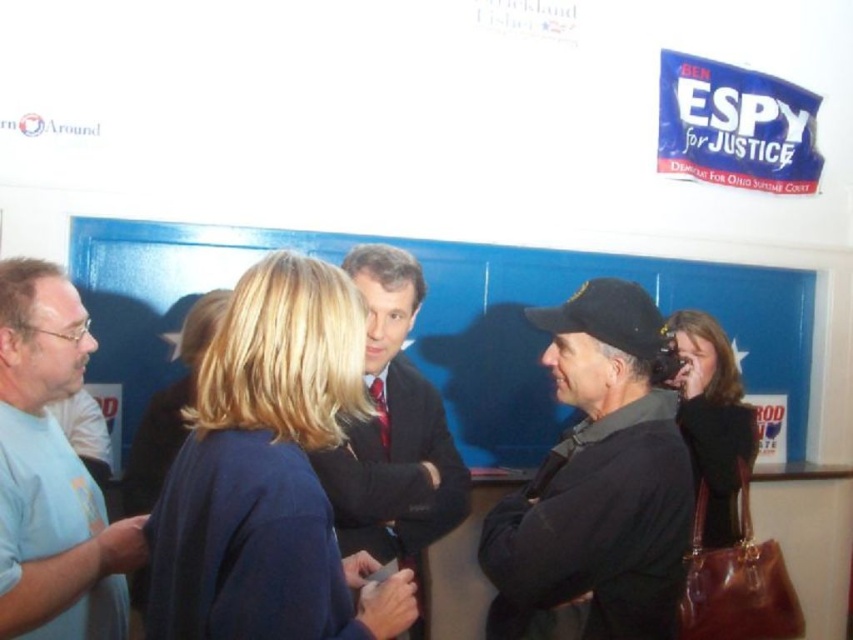
Who is positioned more to the right, dark gray fabric jacket at center or blonde hair at center?

Positioned to the right is dark gray fabric jacket at center.

Who is more distant from viewer, (570, 458) or (183, 394)?

The point (183, 394) is more distant.

This screenshot has height=640, width=853. In order to click on dark gray fabric jacket at center in this screenshot , I will do `click(596, 483)`.

Which of these two, dark gray fabric jacket at center or dark suit at center, stands taller?

dark suit at center is taller.

From the picture: Measure the distance between point (595, 355) and camera.

Point (595, 355) is 1.73 meters from camera.

The height and width of the screenshot is (640, 853). In order to click on dark gray fabric jacket at center in this screenshot , I will do pyautogui.click(x=596, y=483).

Between dark blue fabric jacket at center and dark gray fabric jacket at center, which one is positioned higher?

Positioned higher is dark blue fabric jacket at center.

Does dark blue fabric jacket at center have a smaller size compared to dark gray fabric jacket at center?

No.

Image resolution: width=853 pixels, height=640 pixels. What are the coordinates of `dark blue fabric jacket at center` in the screenshot? It's located at (268, 474).